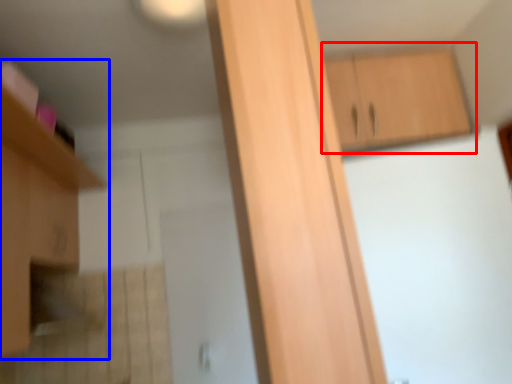
Question: Which object is closer to the camera taking this photo, cabinetry (highlighted by a red box) or cabinetry (highlighted by a blue box)?

Choices:
 (A) cabinetry
 (B) cabinetry

Answer: (B)